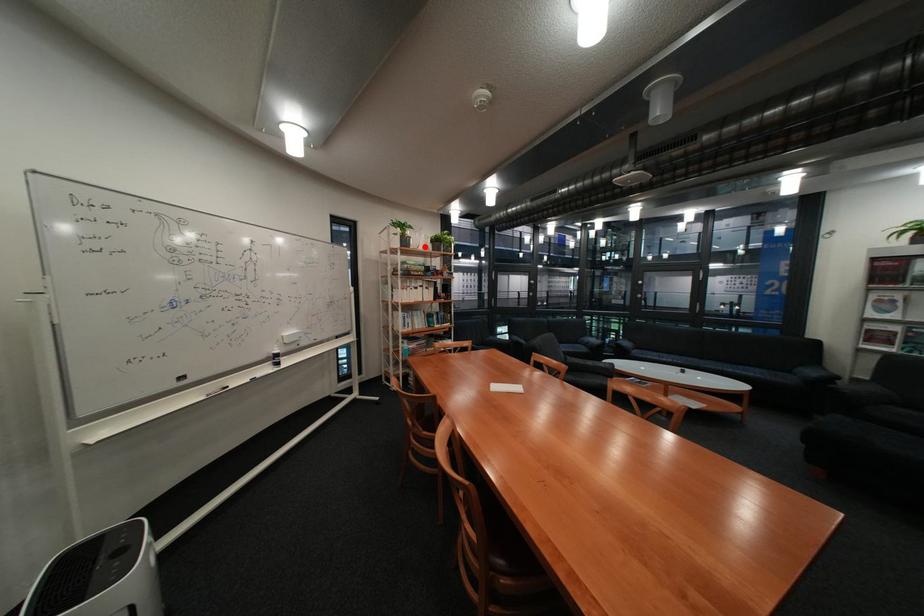
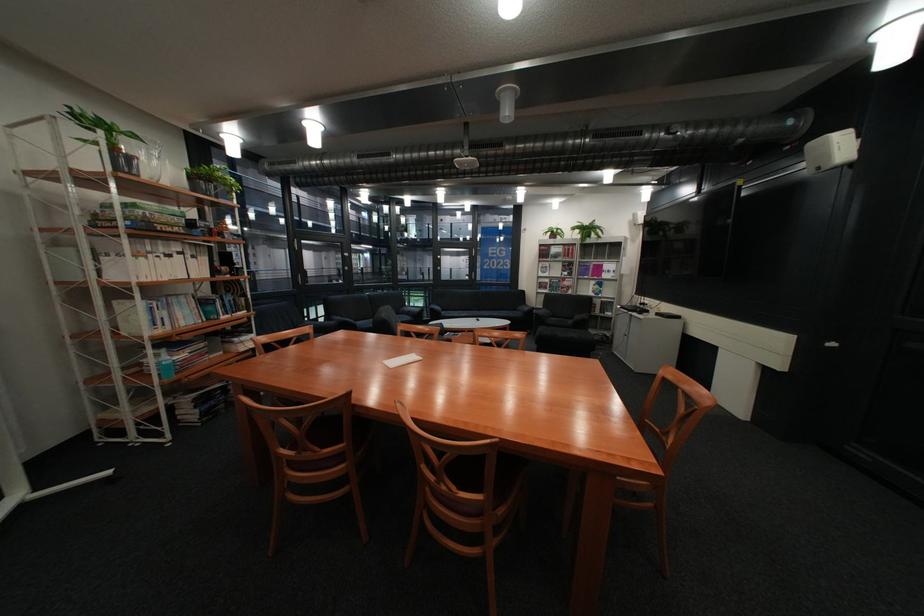
Where in the second image is the point corresponding to the highlighted location from the first image?

(152, 177)